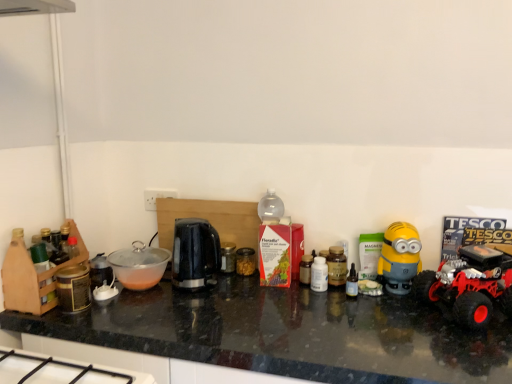
Question: Can you confirm if black granite countertop at center is bigger than translucent plastic bottle at center, which appears as the first bottle when viewed from the left?

Choices:
 (A) no
 (B) yes

Answer: (B)

Question: Is black granite countertop at center far from translucent plastic bottle at center, the fourth bottle positioned from the right?

Choices:
 (A) no
 (B) yes

Answer: (A)

Question: Would you say black granite countertop at center is outside translucent plastic bottle at center, the fourth bottle positioned from the right?

Choices:
 (A) yes
 (B) no

Answer: (A)

Question: Considering the relative sizes of black granite countertop at center and translucent plastic bottle at center, which appears as the first bottle when viewed from the left, in the image provided, is black granite countertop at center wider than translucent plastic bottle at center, which appears as the first bottle when viewed from the left,?

Choices:
 (A) yes
 (B) no

Answer: (A)

Question: Considering the relative positions of black granite countertop at center and translucent plastic bottle at center, the fourth bottle positioned from the right, in the image provided, is black granite countertop at center to the left of translucent plastic bottle at center, the fourth bottle positioned from the right, from the viewer's perspective?

Choices:
 (A) no
 (B) yes

Answer: (B)

Question: Is yellow matte minion toy at right, which appears as the 2th toy when viewed from the back, bigger or smaller than black granite countertop at center?

Choices:
 (A) big
 (B) small

Answer: (B)

Question: Is point (401, 236) closer or farther from the camera than point (223, 278)?

Choices:
 (A) farther
 (B) closer

Answer: (B)

Question: Considering their positions, is yellow matte minion toy at right, positioned as the 1th toy in right-to-left order, located in front of or behind black granite countertop at center?

Choices:
 (A) behind
 (B) front

Answer: (A)

Question: In the image, is yellow matte minion toy at right, the second toy positioned from the left, on the left side or the right side of black granite countertop at center?

Choices:
 (A) right
 (B) left

Answer: (A)

Question: Is transparent plastic bowl at center bigger or smaller than translucent plastic jar at center, acting as the 2th toy starting from the right?

Choices:
 (A) small
 (B) big

Answer: (B)

Question: Visually, is transparent plastic bowl at center positioned to the left or to the right of translucent plastic jar at center, positioned as the 1th toy in back-to-front order?

Choices:
 (A) left
 (B) right

Answer: (A)

Question: From a real-world perspective, is transparent plastic bowl at center physically located above or below translucent plastic jar at center, the 2th toy viewed from the front?

Choices:
 (A) above
 (B) below

Answer: (A)

Question: In the image, is transparent plastic bowl at center positioned in front of or behind translucent plastic jar at center, the 1th toy in the left-to-right sequence?

Choices:
 (A) behind
 (B) front

Answer: (B)

Question: Looking at their shapes, would you say red rubber toy truck at right is wider or thinner than black plastic kettle at center?

Choices:
 (A) wide
 (B) thin

Answer: (A)

Question: Does point (462, 261) appear closer or farther from the camera than point (182, 244)?

Choices:
 (A) farther
 (B) closer

Answer: (A)